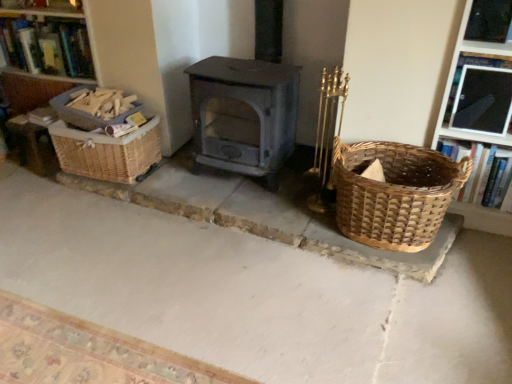
The height and width of the screenshot is (384, 512). What do you see at coordinates (88, 352) in the screenshot? I see `white woven mat at lower center` at bounding box center [88, 352].

The image size is (512, 384). I want to click on woven brown basket at left, acting as the second basket starting from the right, so click(106, 152).

Describe the element at coordinates (106, 152) in the screenshot. The image size is (512, 384). I see `woven brown basket at left, acting as the second basket starting from the right` at that location.

You are a GUI agent. You are given a task and a screenshot of the screen. Output one action in this format:
    pyautogui.click(x=<x>, y=<y>)
    Task: Click on the woven brown basket at right, acting as the 3th basket starting from the left
    Image resolution: width=512 pixels, height=384 pixels.
    Given the screenshot: What is the action you would take?
    pyautogui.click(x=395, y=194)

Describe the element at coordinates (85, 112) in the screenshot. I see `woven wood basket at left, which is the third basket in right-to-left order` at that location.

The height and width of the screenshot is (384, 512). Describe the element at coordinates (256, 293) in the screenshot. I see `natural stone basket at lower right` at that location.

Locate an element on the screen. hardcover book at upper left, the 1th book viewed from the left is located at coordinates (47, 45).

Is hardcover book at upper left, arranged as the 2th book when viewed from the right, directly adjacent to natural stone basket at lower right?

There is a gap between hardcover book at upper left, arranged as the 2th book when viewed from the right, and natural stone basket at lower right.

Locate an element on the screen. book on the left of the natural stone basket at lower right is located at coordinates (47, 45).

Is hardcover book at upper left, which is counted as the first book, starting from the top, smaller than natural stone basket at lower right?

Yes, hardcover book at upper left, which is counted as the first book, starting from the top, is smaller than natural stone basket at lower right.

Is natural stone basket at lower right a part of hardcover book at upper left, positioned as the 2th book in front-to-back order?

No, natural stone basket at lower right is not inside hardcover book at upper left, positioned as the 2th book in front-to-back order.

Is woven basket at right, which is counted as the second book, starting from the back, oriented away from natural stone basket at lower right?

No, woven basket at right, which is counted as the second book, starting from the back,'s orientation is not away from natural stone basket at lower right.

From a real-world perspective, who is located higher, woven basket at right, which is counted as the second book, starting from the back, or natural stone basket at lower right?

woven basket at right, which is counted as the second book, starting from the back, from a real-world perspective.

Is woven basket at right, which is the 1th book from front to back, taller than natural stone basket at lower right?

Indeed, woven basket at right, which is the 1th book from front to back, has a greater height compared to natural stone basket at lower right.

Find the location of `the 2nd basket above when counting from the white woven mat at lower center (from the image's perspective)`. the 2nd basket above when counting from the white woven mat at lower center (from the image's perspective) is located at coordinates (106, 152).

Is white woven mat at lower center wider than woven brown basket at left, which appears as the second basket when viewed from the left?

Yes.

Can you confirm if white woven mat at lower center is positioned to the left of woven brown basket at left, acting as the second basket starting from the right?

Incorrect, white woven mat at lower center is not on the left side of woven brown basket at left, acting as the second basket starting from the right.

Which of these two, natural stone basket at lower right or white woven mat at lower center, is wider?

natural stone basket at lower right.

Can you confirm if natural stone basket at lower right is smaller than white woven mat at lower center?

No, natural stone basket at lower right is not smaller than white woven mat at lower center.

Is point (369, 322) closer or farther from the camera than point (32, 336)?

Point (369, 322) is farther from the camera than point (32, 336).

Does natural stone basket at lower right turn towards white woven mat at lower center?

Yes, natural stone basket at lower right is oriented towards white woven mat at lower center.

Considering the positions of objects woven wood basket at left and woven brown basket at left, acting as the second basket starting from the right, in the image provided, who is more to the right, woven wood basket at left or woven brown basket at left, acting as the second basket starting from the right,?

woven brown basket at left, acting as the second basket starting from the right.

Based on the photo, is there a large distance between woven wood basket at left and woven brown basket at left, which appears as the second basket when viewed from the left?

No, there isn't a large distance between woven wood basket at left and woven brown basket at left, which appears as the second basket when viewed from the left.

Does woven wood basket at left have a greater width compared to woven brown basket at left, acting as the second basket starting from the right?

Indeed, woven wood basket at left has a greater width compared to woven brown basket at left, acting as the second basket starting from the right.

Image resolution: width=512 pixels, height=384 pixels. I want to click on the 3rd basket located beneath the woven wood basket at left (from a real-world perspective), so click(x=106, y=152).

Considering the positions of points (110, 124) and (54, 95), is point (110, 124) closer to camera compared to point (54, 95)?

That is True.

Considering the relative sizes of woven wood basket at left, which is the third basket in right-to-left order, and woven wood basket at left in the image provided, is woven wood basket at left, which is the third basket in right-to-left order, smaller than woven wood basket at left?

Indeed, woven wood basket at left, which is the third basket in right-to-left order, has a smaller size compared to woven wood basket at left.

Is woven wood basket at left, placed as the 1th basket when sorted from left to right, facing away from woven wood basket at left?

No, woven wood basket at left, placed as the 1th basket when sorted from left to right, is not facing away from woven wood basket at left.

Considering the sizes of woven wood basket at left, which is the third basket in right-to-left order, and woven wood basket at left in the image, is woven wood basket at left, which is the third basket in right-to-left order, wider or thinner than woven wood basket at left?

Considering their sizes, woven wood basket at left, which is the third basket in right-to-left order, looks slimmer than woven wood basket at left.

Between white woven mat at lower center and woven wood basket at left, which is the third basket in right-to-left order, which one has smaller width?

woven wood basket at left, which is the third basket in right-to-left order.

In the scene shown: Is white woven mat at lower center surrounding woven wood basket at left, placed as the 1th basket when sorted from left to right?

No, woven wood basket at left, placed as the 1th basket when sorted from left to right, is not a part of white woven mat at lower center.

Could you tell me if white woven mat at lower center is turned towards woven wood basket at left, placed as the 1th basket when sorted from left to right?

No, white woven mat at lower center is not facing towards woven wood basket at left, placed as the 1th basket when sorted from left to right.

From the image's perspective, count 2nd books upward from the natural stone basket at lower right and point to it. Please provide its 2D coordinates.

[(47, 45)]

Locate an element on the screen. concrete located below the woven basket at right, the second book positioned from the top (from the image's perspective) is located at coordinates (256, 293).

Based on their spatial positions, is woven basket at right, arranged as the first book when viewed from the right, or woven wood basket at left further from woven brown basket at left, which appears as the second basket when viewed from the left?

Based on the image, woven basket at right, arranged as the first book when viewed from the right, appears to be further to woven brown basket at left, which appears as the second basket when viewed from the left.

Based on their spatial positions, is woven wood basket at left or woven brown basket at left, acting as the second basket starting from the right, further from hardcover book at upper left, the 1th book viewed from the left?

Based on the image, woven brown basket at left, acting as the second basket starting from the right, appears to be further to hardcover book at upper left, the 1th book viewed from the left.

From the image, which object appears to be farther from woven basket at right, placed as the second book when sorted from left to right, woven brown basket at right, acting as the 3th basket starting from the left, or woven wood basket at left?

The object further to woven basket at right, placed as the second book when sorted from left to right, is woven wood basket at left.

Considering their positions, is natural stone basket at lower right positioned further to woven wood basket at left, which is the third basket in right-to-left order, than woven brown basket at left, which appears as the second basket when viewed from the left?

natural stone basket at lower right lies further to woven wood basket at left, which is the third basket in right-to-left order, than the other object.

Estimate the real-world distances between objects in this image. Which object is further from woven wood basket at left, woven brown basket at right, acting as the 3th basket starting from the left, or hardcover book at upper left, the 1th book viewed from the left?

Based on the image, woven brown basket at right, acting as the 3th basket starting from the left, appears to be further to woven wood basket at left.

When comparing their distances from woven wood basket at left, does hardcover book at upper left, which is counted as the 1th book, starting from the back, or woven brown basket at right, the 1th basket viewed from the right, seem further?

Based on the image, woven brown basket at right, the 1th basket viewed from the right, appears to be further to woven wood basket at left.

Consider the image. Which object lies further to the anchor point woven wood basket at left, natural stone basket at lower right or white woven mat at lower center?

Among the two, white woven mat at lower center is located further to woven wood basket at left.

From the image, which object appears to be farther from woven basket at right, placed as the second book when sorted from left to right, hardcover book at upper left, positioned as the 2th book in front-to-back order, or woven wood basket at left?

woven wood basket at left is further to woven basket at right, placed as the second book when sorted from left to right.

Find the location of `bookshelf between natural stone basket at lower right and hardcover book at upper left, which is counted as the first book, starting from the top, from front to back`. bookshelf between natural stone basket at lower right and hardcover book at upper left, which is counted as the first book, starting from the top, from front to back is located at coordinates (47, 45).

Find the location of a particular element. mat between natural stone basket at lower right and hardcover book at upper left, positioned as the 2th book in front-to-back order, from front to back is located at coordinates (88, 352).

This screenshot has height=384, width=512. What are the coordinates of `bookshelf between hardcover book at upper left, positioned as the 2th book in front-to-back order, and white woven mat at lower center from top to bottom` in the screenshot? It's located at (47, 45).

This screenshot has width=512, height=384. Identify the location of book between woven wood basket at left and woven brown basket at right, the 1th basket viewed from the right, in the horizontal direction. (47, 45).